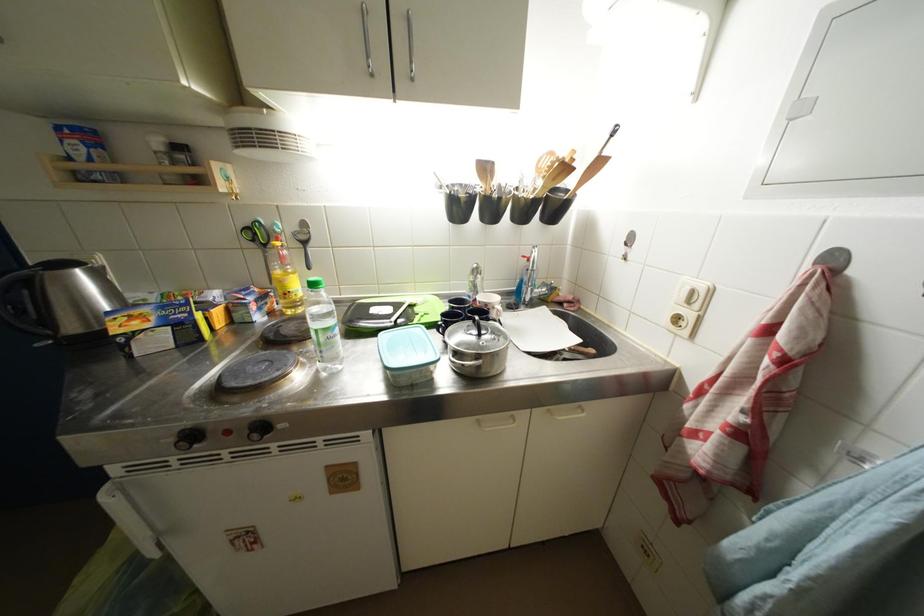
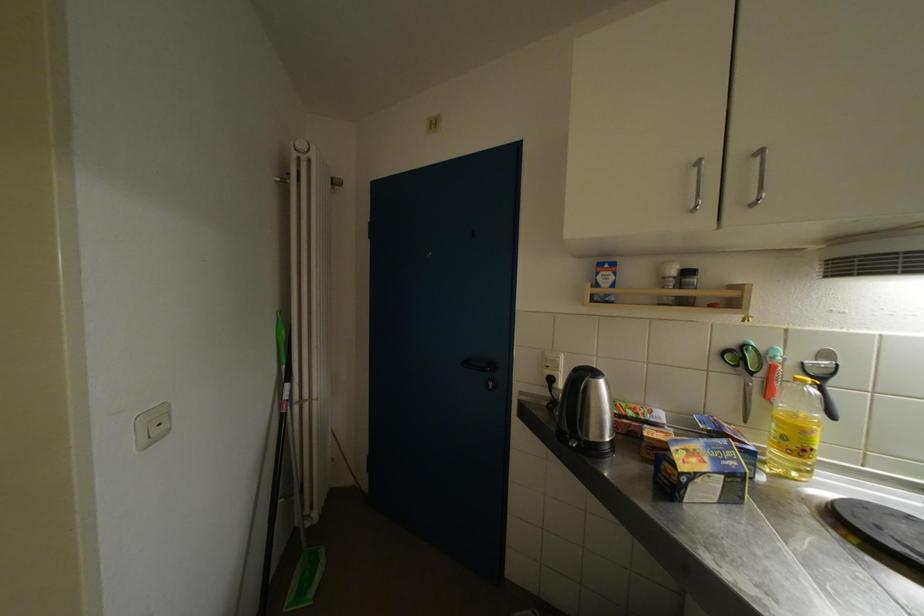
Question: The camera is either moving clockwise (left) or counter-clockwise (right) around the object. The first image is from the beginning of the video and the second image is from the end. Is the camera moving left or right when shooting the video?

Choices:
 (A) Left
 (B) Right

Answer: (B)